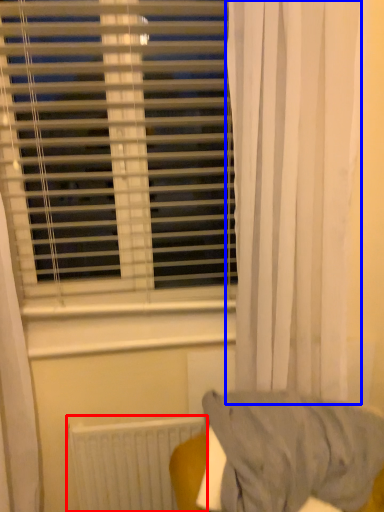
Question: Which object is further to the camera taking this photo, radiator (highlighted by a red box) or curtain (highlighted by a blue box)?

Choices:
 (A) radiator
 (B) curtain

Answer: (A)